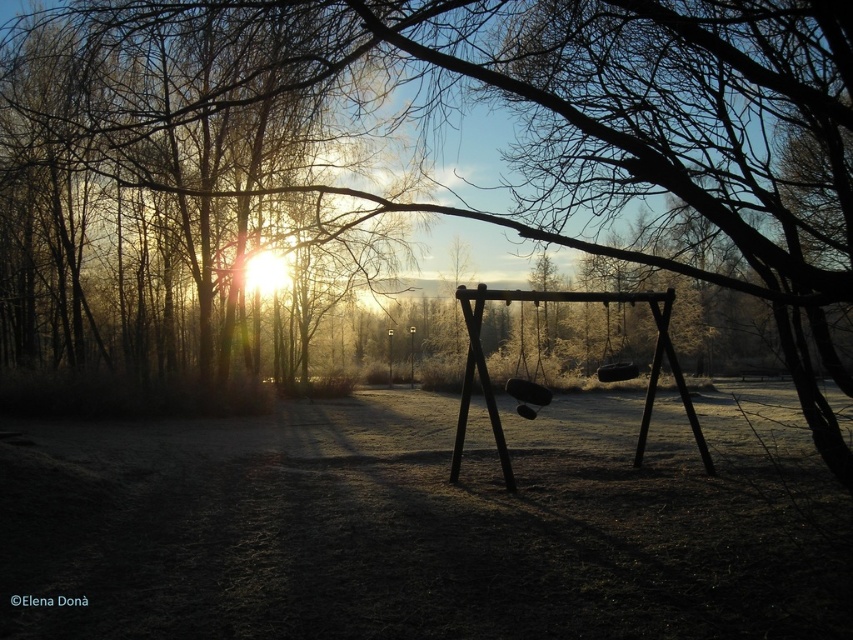
You are a parent trying to decide which swing to let your child play on. The wooden swing at center and the black rubber swing at center are both available. According to the scene, which swing is positioned to the left?

The wooden swing at center is to the left of the black rubber swing at center, so the wooden swing at center is positioned to the left.